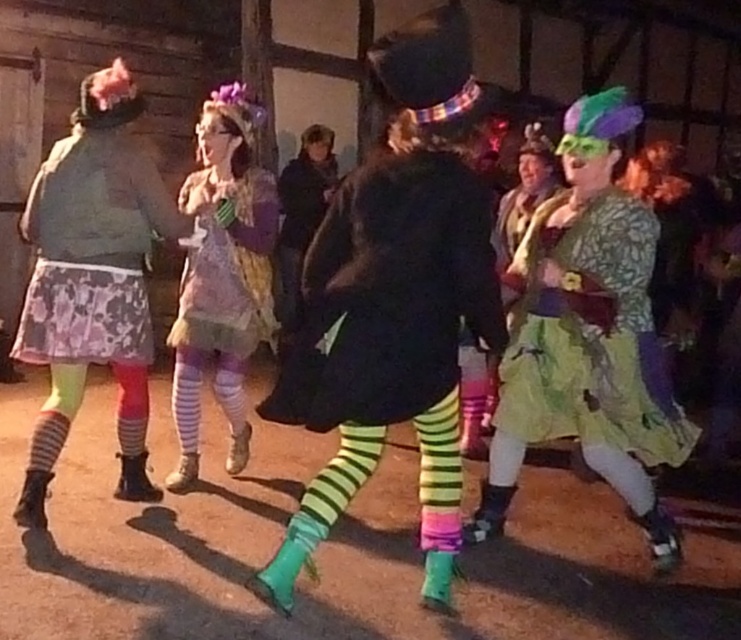
You are organizing a photo shoot and need to arrange two dresses in the center of the scene. The green floral dress at center and the matte purple dress at center are both in the center. Based on their widths, which dress should be placed to the left to ensure they don t overlap?

The green floral dress at center is wider than the matte purple dress at center, so placing the wider green floral dress at center to the left would allow more space between them, preventing overlap.

You are standing in the scene and want to take a photo of both the point at coordinates point (622,381) and point (213,348). Which point should you focus on first to ensure both are in focus?

You should focus on point (622,381) first because it is closer to the camera than point (213,348), ensuring both points are within the depth of field.